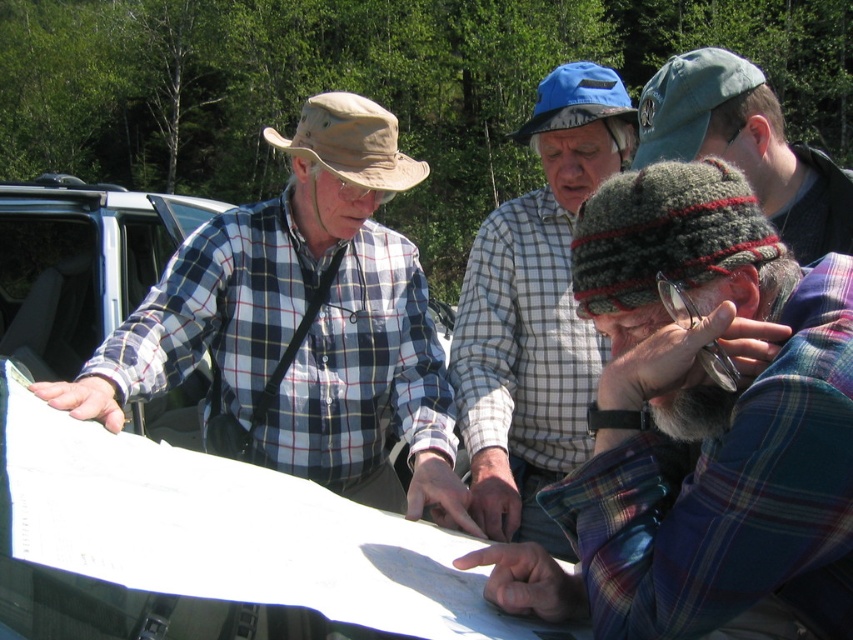
Question: Which object is the farthest from the plaid shirt at center?

Choices:
 (A) knitted wool hat at center
 (B) plaid flannel shirt at center
 (C) plaid shirt at left

Answer: (B)

Question: Estimate the real-world distances between objects in this image. Which object is closer to the plaid flannel shirt at center?

Choices:
 (A) plaid shirt at center
 (B) plaid shirt at left
 (C) knitted wool hat at center

Answer: (C)

Question: Is plaid flannel shirt at center below plaid shirt at center?

Choices:
 (A) yes
 (B) no

Answer: (A)

Question: Which point is closer to the camera?

Choices:
 (A) plaid flannel shirt at center
 (B) plaid shirt at left
 (C) knitted wool hat at center

Answer: (A)

Question: Is plaid shirt at left further to camera compared to knitted wool hat at center?

Choices:
 (A) no
 (B) yes

Answer: (B)

Question: Does plaid shirt at center have a lesser width compared to knitted wool hat at center?

Choices:
 (A) yes
 (B) no

Answer: (A)